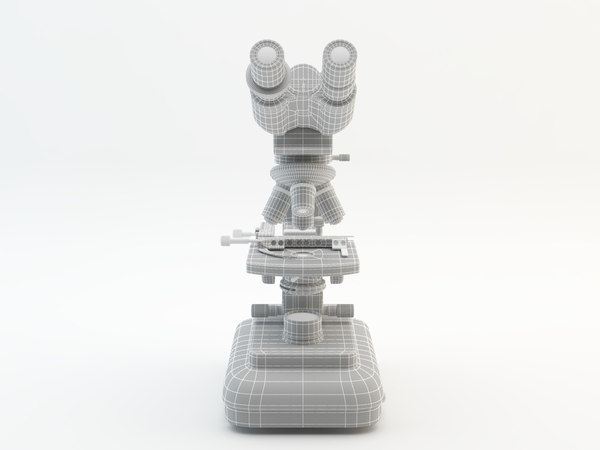
Identify the location of microscope base. The width and height of the screenshot is (600, 450). (301, 393).